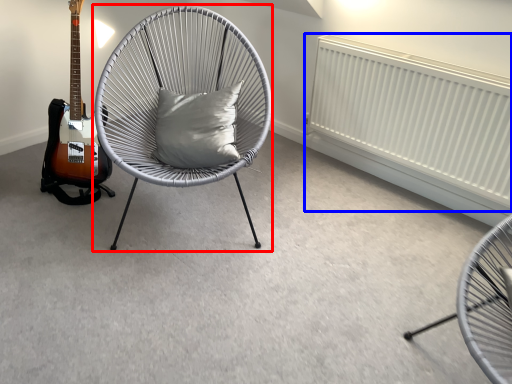
Question: Which of the following is the farthest to the observer, chair (highlighted by a red box) or radiator (highlighted by a blue box)?

Choices:
 (A) chair
 (B) radiator

Answer: (B)